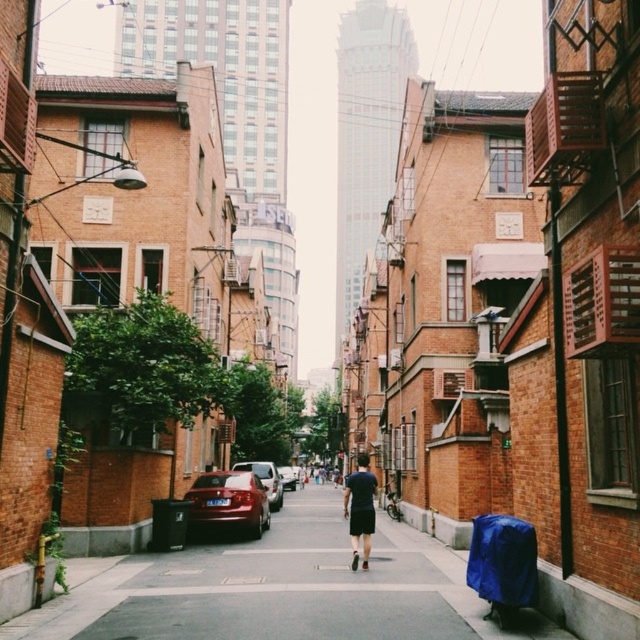
Question: Which point appears closest to the camera in this image?

Choices:
 (A) (368, 464)
 (B) (250, 474)
 (C) (269, 481)
 (D) (284, 467)

Answer: (B)

Question: Is dark blue fabric shorts at center to the right of shiny silver sedan at center from the viewer's perspective?

Choices:
 (A) yes
 (B) no

Answer: (A)

Question: Which object is the closest to the dark blue fabric shorts at center?

Choices:
 (A) silver metallic sedan at center
 (B) shiny silver sedan at center

Answer: (B)

Question: Is shiny silver sedan at center in front of silver metallic sedan at center?

Choices:
 (A) no
 (B) yes

Answer: (B)

Question: Is dark blue fabric shorts at center to the right of shiny silver sedan at center from the viewer's perspective?

Choices:
 (A) no
 (B) yes

Answer: (B)

Question: Based on their relative distances, which object is nearer to the shiny red car at center?

Choices:
 (A) silver metallic sedan at center
 (B) dark blue fabric shorts at center
 (C) shiny silver sedan at center

Answer: (B)